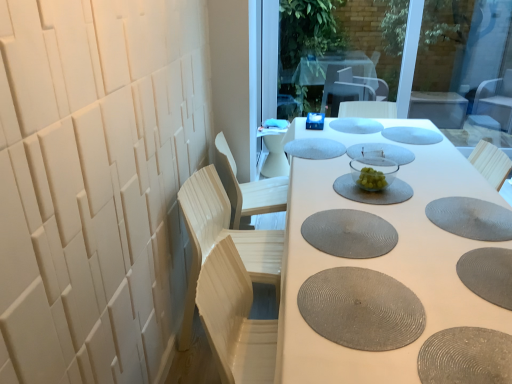
Where is `free location to the right of clear glass bowl at center, the sixth manhole cover positioned from the front`? The image size is (512, 384). free location to the right of clear glass bowl at center, the sixth manhole cover positioned from the front is located at coordinates (436, 186).